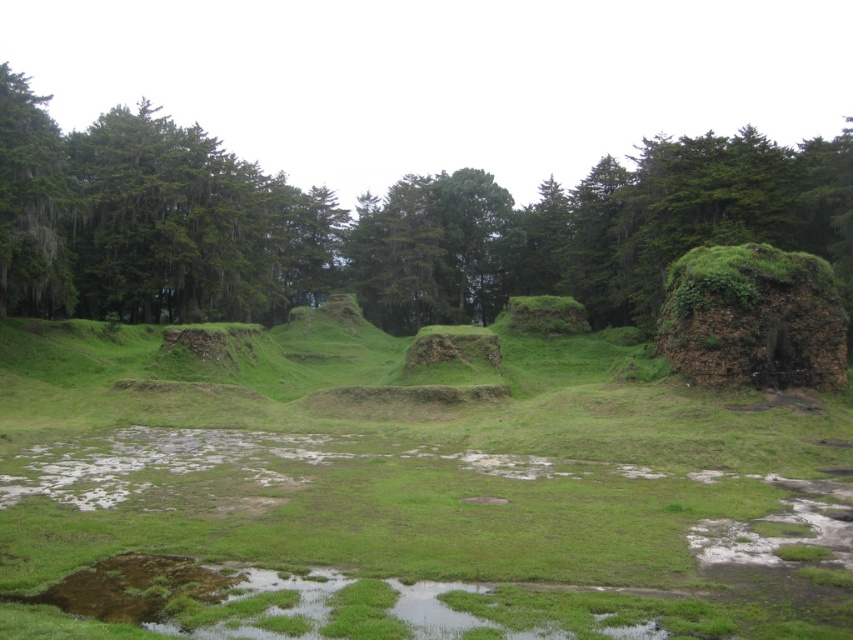
Question: Considering the relative positions of green leafy tree at center and green mossy rock at right in the image provided, where is green leafy tree at center located with respect to green mossy rock at right?

Choices:
 (A) above
 (B) below

Answer: (A)

Question: Which of the following is the closest to the observer?

Choices:
 (A) green grassy mound at center
 (B) green mossy rock at right
 (C) green mossy tree at left

Answer: (A)

Question: Which of the following is the farthest from the observer?

Choices:
 (A) (509, 378)
 (B) (738, 380)

Answer: (A)

Question: Which point is closer to the camera?

Choices:
 (A) (297, 369)
 (B) (0, 67)
 (C) (57, 220)

Answer: (C)

Question: Does green mossy rock at right have a smaller size compared to green mossy tree at left?

Choices:
 (A) no
 (B) yes

Answer: (B)

Question: Is green leafy tree at center to the left of green mossy tree at left from the viewer's perspective?

Choices:
 (A) no
 (B) yes

Answer: (A)